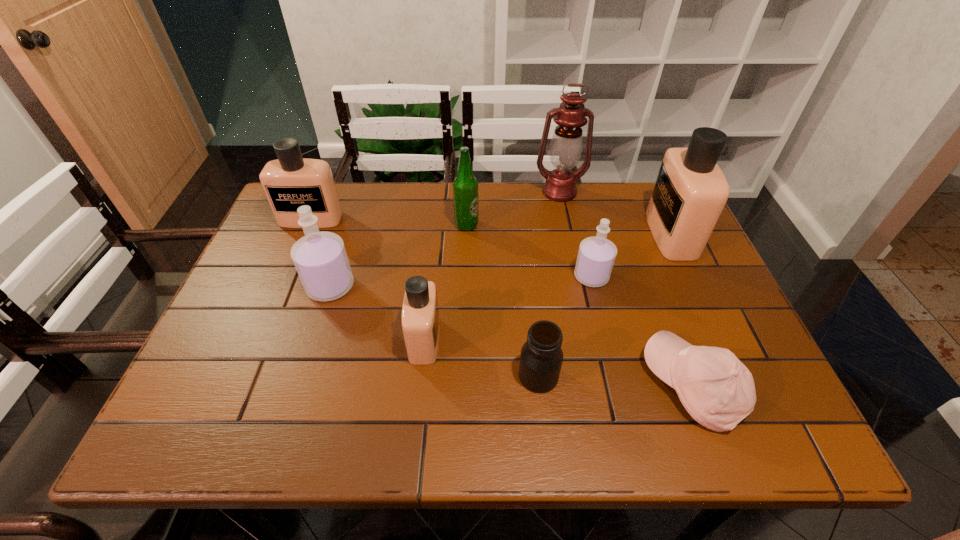
Find the location of a particular element. Image resolution: width=960 pixels, height=540 pixels. red oil lamp is located at coordinates (566, 145).

Find the location of `the farthest object`. the farthest object is located at coordinates (566, 145).

Identify the location of the biggest beige perfume. The width and height of the screenshot is (960, 540). pos(690,192).

This screenshot has height=540, width=960. Identify the location of the rightmost perfume. (690, 192).

This screenshot has height=540, width=960. Find the location of `green beer bottle`. green beer bottle is located at coordinates tap(465, 186).

Identify the location of the sixth object from right to left. The image size is (960, 540). (465, 186).

The width and height of the screenshot is (960, 540). Find the location of `the left purple perfume`. the left purple perfume is located at coordinates (320, 258).

At what (x,y) coordinates should I click in order to perform the action: click on the second biggest beige perfume. Please return your answer as a coordinate pair (x, y). The width and height of the screenshot is (960, 540). Looking at the image, I should click on (291, 181).

Locate an element on the screen. Image resolution: width=960 pixels, height=540 pixels. the third object from left to right is located at coordinates (420, 315).

This screenshot has width=960, height=540. In order to click on the second beige perfume from left to right in this screenshot , I will do `click(420, 315)`.